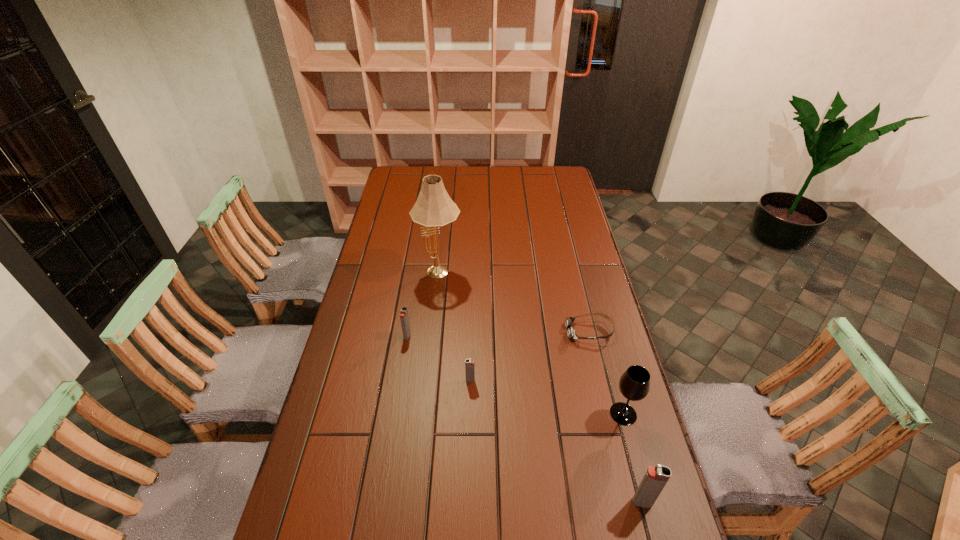
Where is `the second shortest igniter`? The image size is (960, 540). the second shortest igniter is located at coordinates (404, 318).

Identify the location of the third shortest object. (404, 318).

Identify the location of the third nearest object. (469, 364).

The height and width of the screenshot is (540, 960). In order to click on the third object from left to right in this screenshot , I will do `click(469, 364)`.

Identify the location of the nearest igniter. This screenshot has width=960, height=540. (655, 478).

At what (x,y) coordinates should I click in order to perform the action: click on the tallest igniter. Please return your answer as a coordinate pair (x, y). The width and height of the screenshot is (960, 540). Looking at the image, I should click on (655, 478).

Where is `the farthest object`? the farthest object is located at coordinates (434, 207).

In order to click on the tallest object in this screenshot , I will do `click(434, 207)`.

Identify the location of the shortest object. Image resolution: width=960 pixels, height=540 pixels. (571, 333).

Locate an element on the screen. wineglass is located at coordinates tap(634, 384).